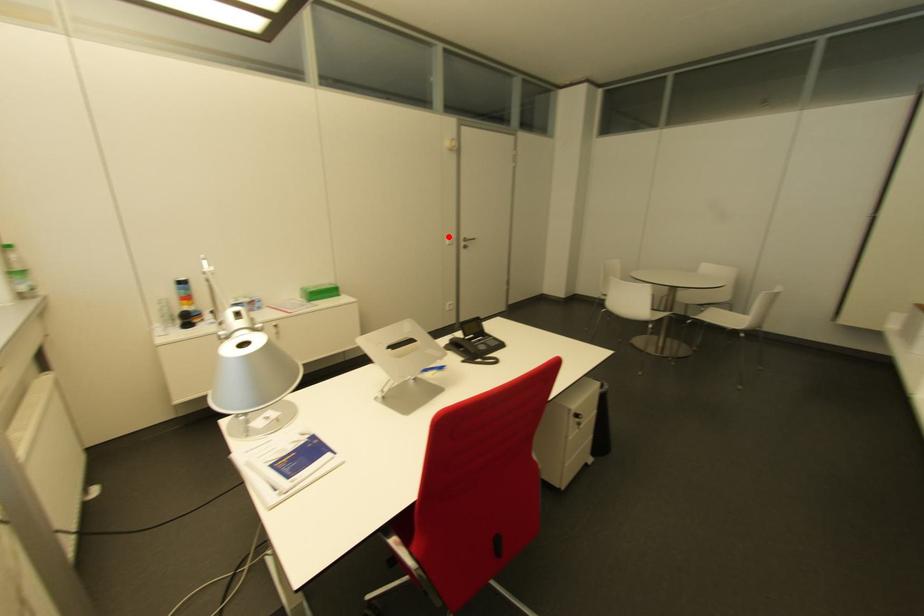
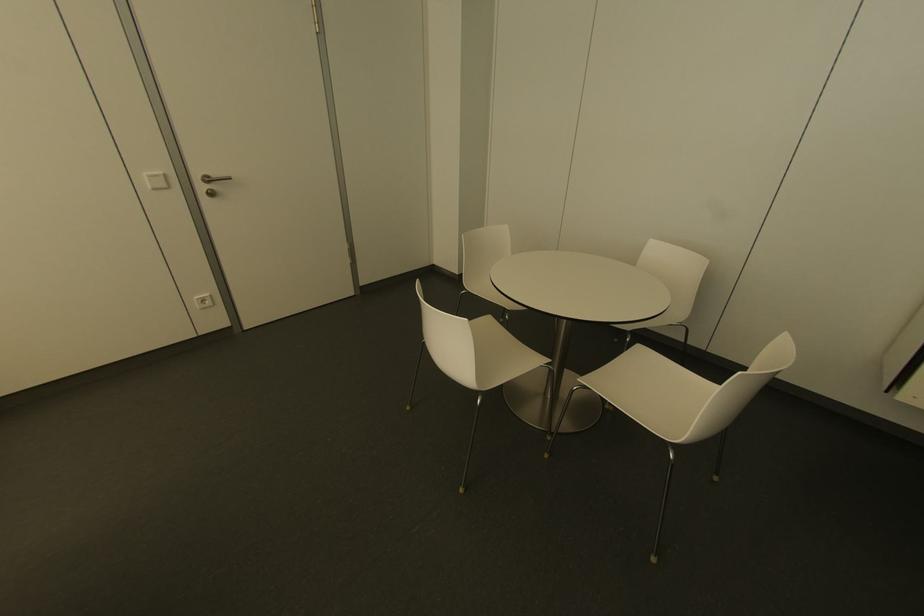
Question: I am providing you with two images of the same scene from different viewpoints. Image1 has a red point marked. In image2, the corresponding 3D location appears at what relative position? Reply with the corresponding letter.

Choices:
 (A) Closer
 (B) Farther

Answer: (B)